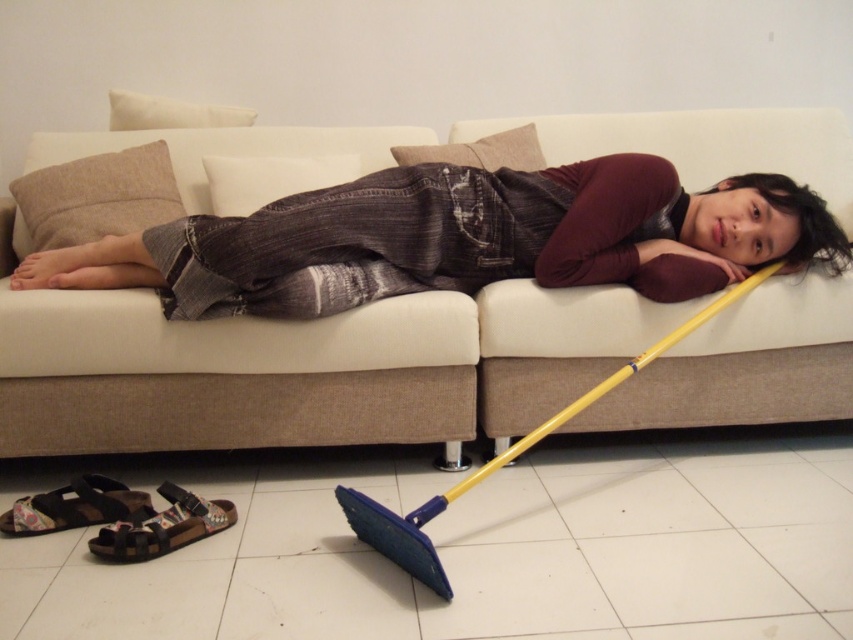
Question: Which object appears closest to the camera in this image?

Choices:
 (A) white fabric couch at center
 (B) denim jeans at center

Answer: (B)

Question: Is white fabric couch at center positioned before denim jeans at center?

Choices:
 (A) no
 (B) yes

Answer: (A)

Question: Which of the following is the farthest from the observer?

Choices:
 (A) white fabric couch at center
 (B) denim jeans at center

Answer: (A)

Question: Is white fabric couch at center thinner than denim jeans at center?

Choices:
 (A) yes
 (B) no

Answer: (B)

Question: Is white fabric couch at center positioned behind denim jeans at center?

Choices:
 (A) yes
 (B) no

Answer: (A)